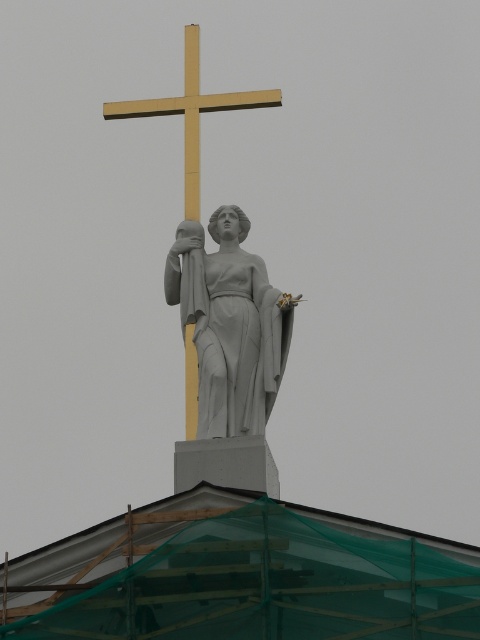
You are a photographer standing at the camera position. You want to take a photo of the white marble statue at center. If your camera has a maximum focus range of 100 meters, will you be able to focus on the statue?

The white marble statue at center is 109.80 meters from camera, which exceeds the camera maximum focus range of 100 meters. Therefore, the camera cannot focus on the statue.

Consider the image. You are a construction worker tasked with installing a new lighting fixture between the white marble statue at center and the gold polished wood cross at upper center. The fixture requires a minimum of 5 meters of space between them to be installed safely. Can you install the fixture between them?

The distance between the white marble statue at center and the gold polished wood cross at upper center is 6.67 meters, which exceeds the required 5 meters. Therefore, the lighting fixture can be safely installed between them.